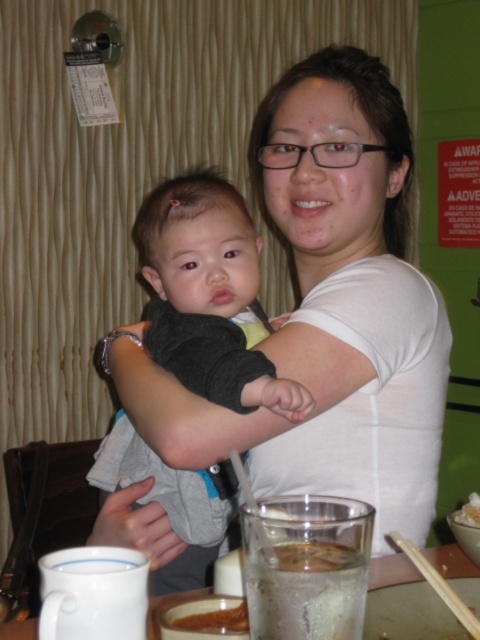
You are a waiter in a restaurant and you see the clear glass water at lower center and the brown creamy soup at lower center on the table. Which one takes up more space on the table?

The clear glass water at lower center takes up more space on the table because it is bigger than the brown creamy soup at lower center.